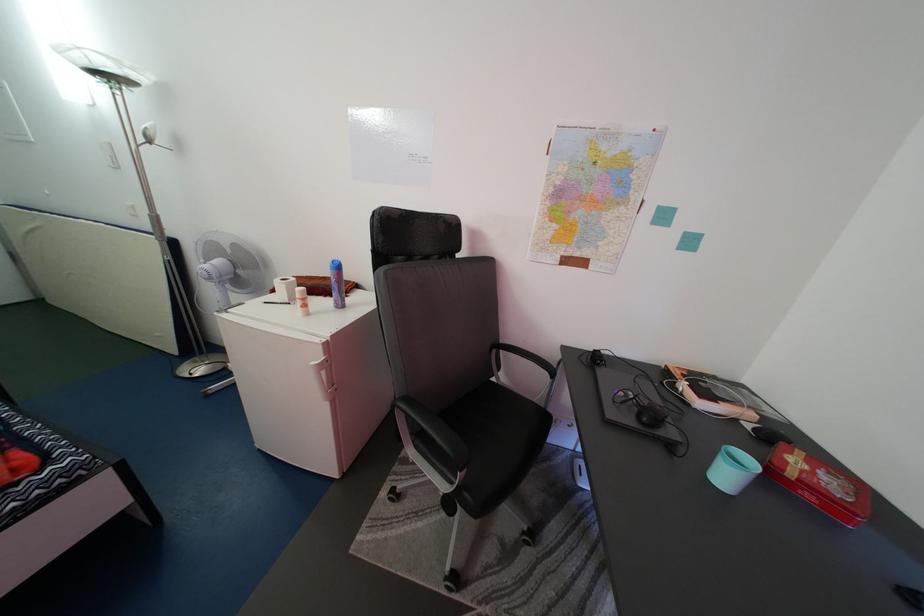
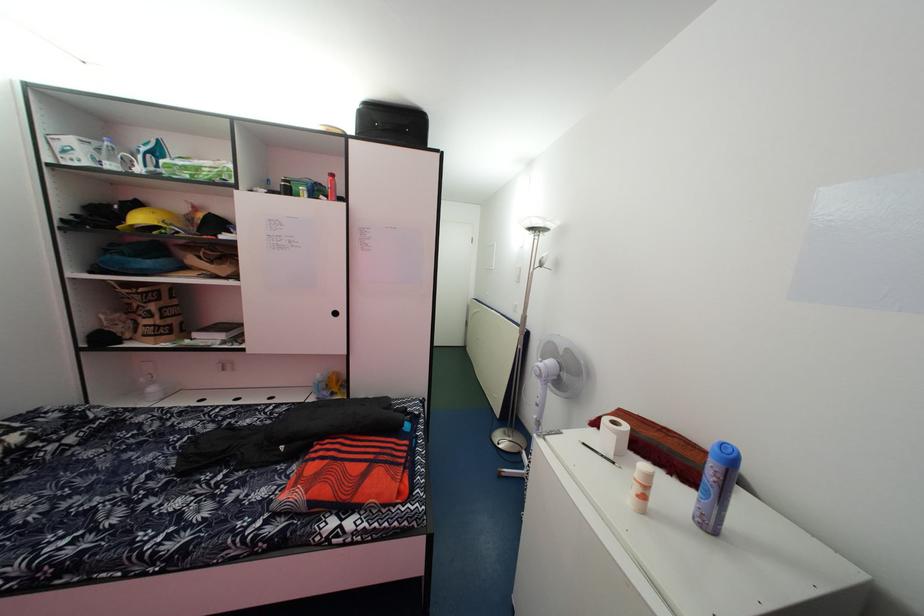
Question: The camera is either moving clockwise (left) or counter-clockwise (right) around the object. The first image is from the beginning of the video and the second image is from the end. Is the camera moving left or right when shooting the video?

Choices:
 (A) Left
 (B) Right

Answer: (B)